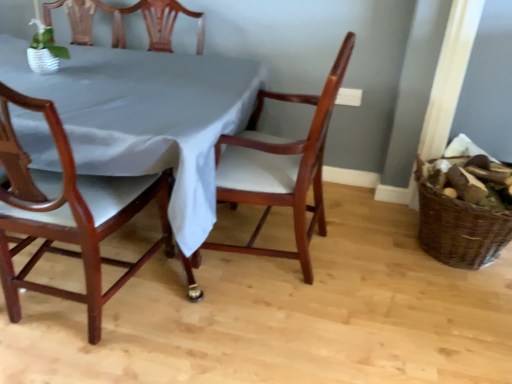
Question: Is mahogany wood chair at center, the second chair when ordered from left to right, oriented towards brown woven basket at right?

Choices:
 (A) no
 (B) yes

Answer: (A)

Question: Does mahogany wood chair at center, the second chair when ordered from left to right, have a greater height compared to brown woven basket at right?

Choices:
 (A) yes
 (B) no

Answer: (A)

Question: From the image's perspective, is mahogany wood chair at center, the 1th chair in the right-to-left sequence, on top of brown woven basket at right?

Choices:
 (A) no
 (B) yes

Answer: (B)

Question: Considering the relative sizes of mahogany wood chair at center, the 1th chair in the right-to-left sequence, and brown woven basket at right in the image provided, is mahogany wood chair at center, the 1th chair in the right-to-left sequence, shorter than brown woven basket at right?

Choices:
 (A) no
 (B) yes

Answer: (A)

Question: Can you confirm if mahogany wood chair at center, the 1th chair in the right-to-left sequence, is bigger than brown woven basket at right?

Choices:
 (A) no
 (B) yes

Answer: (B)

Question: Is mahogany wood chair at center, the 1th chair in the right-to-left sequence, outside brown woven basket at right?

Choices:
 (A) no
 (B) yes

Answer: (B)

Question: Is mahogany wood chair at center, the 1th chair in the right-to-left sequence, not close to mahogany wood chair at left, the second chair in the right-to-left sequence?

Choices:
 (A) yes
 (B) no

Answer: (B)

Question: Is mahogany wood chair at center, the 1th chair in the right-to-left sequence, smaller than mahogany wood chair at left, the second chair in the right-to-left sequence?

Choices:
 (A) no
 (B) yes

Answer: (A)

Question: Is mahogany wood chair at center, the second chair when ordered from left to right, positioned beyond the bounds of mahogany wood chair at left, positioned as the first chair in left-to-right order?

Choices:
 (A) yes
 (B) no

Answer: (A)

Question: Is the depth of mahogany wood chair at center, the second chair when ordered from left to right, greater than that of mahogany wood chair at left, the second chair in the right-to-left sequence?

Choices:
 (A) yes
 (B) no

Answer: (A)

Question: From the image's perspective, does mahogany wood chair at center, the second chair when ordered from left to right, appear lower than mahogany wood chair at left, the second chair in the right-to-left sequence?

Choices:
 (A) no
 (B) yes

Answer: (A)

Question: Is mahogany wood chair at center, the second chair when ordered from left to right, looking in the opposite direction of mahogany wood chair at left, the second chair in the right-to-left sequence?

Choices:
 (A) no
 (B) yes

Answer: (A)

Question: From a real-world perspective, is mahogany wood chair at left, the second chair in the right-to-left sequence, on top of satin white tablecloth at center?

Choices:
 (A) yes
 (B) no

Answer: (A)